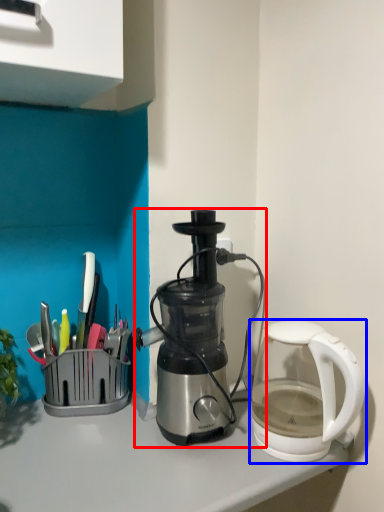
Question: Which object is further to the camera taking this photo, coffee maker (highlighted by a red box) or kettle (highlighted by a blue box)?

Choices:
 (A) coffee maker
 (B) kettle

Answer: (A)